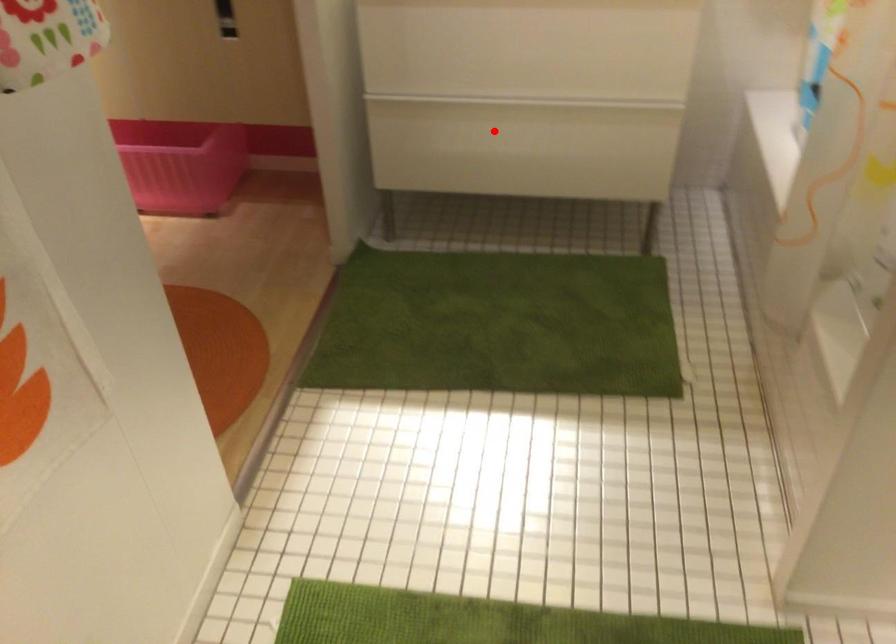
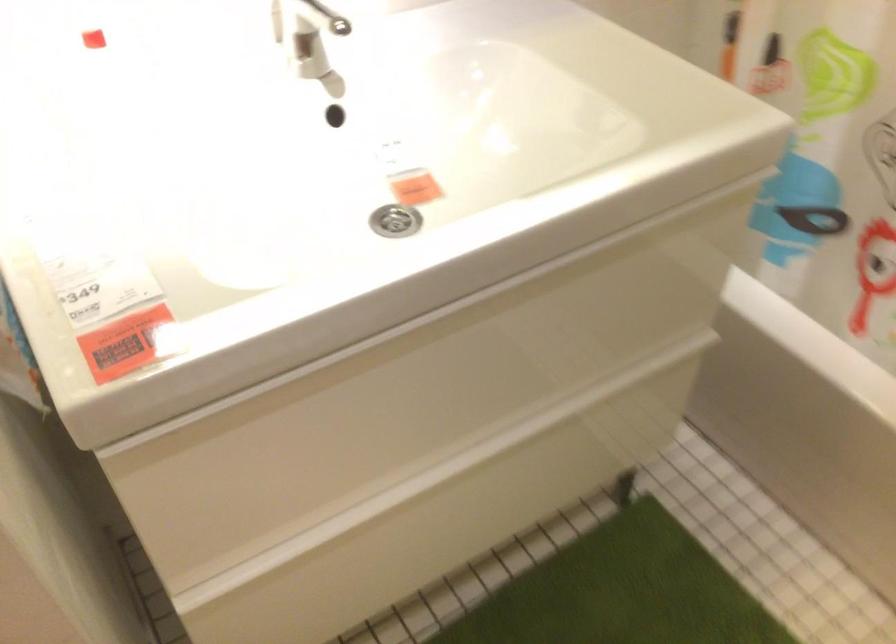
The point at the highlighted location is marked in the first image. Where is the corresponding point in the second image?

(442, 514)